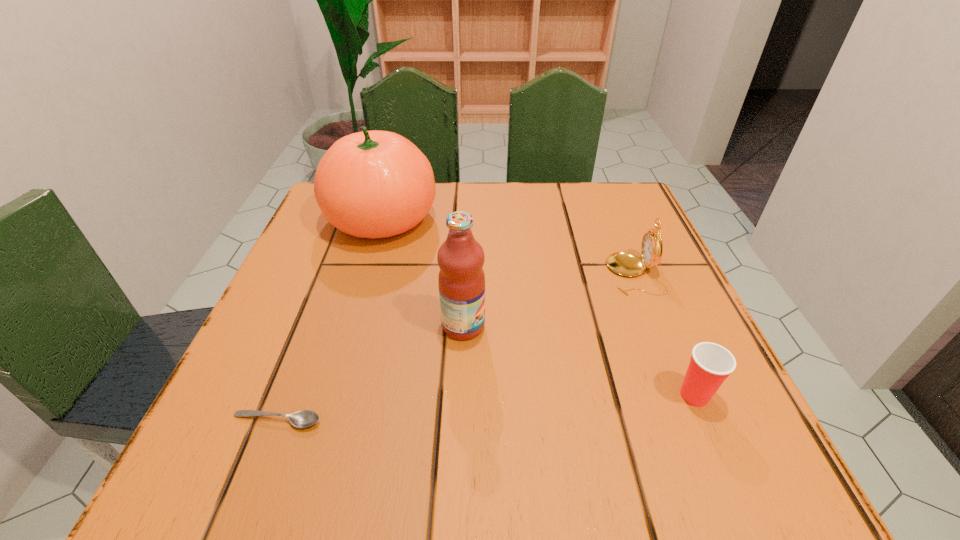
Identify the location of free space located on the face of the fourth nearest object. (583, 274).

The image size is (960, 540). In order to click on vacant space located 0.240m on the face of the fourth nearest object in this screenshot , I will do `click(482, 274)`.

You are a GUI agent. You are given a task and a screenshot of the screen. Output one action in this format:
    pyautogui.click(x=<x>, y=<y>)
    Task: Click on the free spot located on the front of the Dixie cup
    The image size is (960, 540).
    Given the screenshot: What is the action you would take?
    pyautogui.click(x=729, y=476)

Where is `vacant space situated on the back of the shortest object`? The image size is (960, 540). vacant space situated on the back of the shortest object is located at coordinates (299, 364).

Locate an element on the screen. object that is at the far edge is located at coordinates (374, 184).

The width and height of the screenshot is (960, 540). In order to click on object at the near edge in this screenshot , I will do `click(305, 418)`.

The height and width of the screenshot is (540, 960). Identify the location of pumpkin at the left edge. (374, 184).

The height and width of the screenshot is (540, 960). In order to click on soupspoon that is at the left edge in this screenshot , I will do pyautogui.click(x=305, y=418).

Locate an element on the screen. The width and height of the screenshot is (960, 540). pocket watch that is at the right edge is located at coordinates (626, 264).

Find the location of a particular element. The height and width of the screenshot is (540, 960). Dixie cup at the right edge is located at coordinates (710, 364).